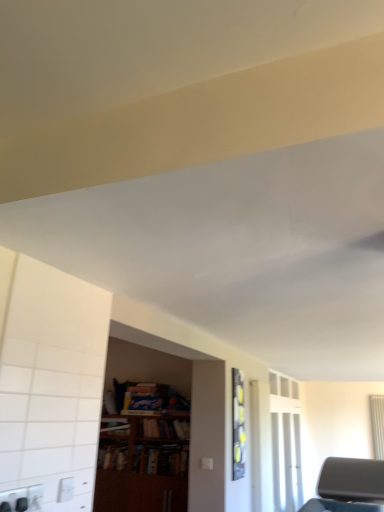
Question: Does transparent glass door at right appear on the left side of wooden bookcase at center?

Choices:
 (A) no
 (B) yes

Answer: (A)

Question: Is transparent glass door at right wider than wooden bookcase at center?

Choices:
 (A) yes
 (B) no

Answer: (B)

Question: Does transparent glass door at right have a lesser height compared to wooden bookcase at center?

Choices:
 (A) yes
 (B) no

Answer: (B)

Question: From the image's perspective, would you say transparent glass door at right is shown under wooden bookcase at center?

Choices:
 (A) no
 (B) yes

Answer: (B)

Question: Is transparent glass door at right bigger than wooden bookcase at center?

Choices:
 (A) no
 (B) yes

Answer: (A)

Question: Is transparent glass door at right to the right of wooden bookcase at center from the viewer's perspective?

Choices:
 (A) no
 (B) yes

Answer: (B)

Question: Is white plastic electric outlet at lower left facing towards wooden bookshelf at center?

Choices:
 (A) no
 (B) yes

Answer: (A)

Question: From the image's perspective, is white plastic electric outlet at lower left under wooden bookshelf at center?

Choices:
 (A) no
 (B) yes

Answer: (A)

Question: From a real-world perspective, is white plastic electric outlet at lower left positioned over wooden bookshelf at center based on gravity?

Choices:
 (A) yes
 (B) no

Answer: (B)

Question: Does white plastic electric outlet at lower left have a smaller size compared to wooden bookshelf at center?

Choices:
 (A) yes
 (B) no

Answer: (A)

Question: From a real-world perspective, is white plastic electric outlet at lower left beneath wooden bookshelf at center?

Choices:
 (A) no
 (B) yes

Answer: (B)

Question: From the image's perspective, is white plastic electric outlet at lower left on top of wooden bookshelf at center?

Choices:
 (A) no
 (B) yes

Answer: (B)

Question: From the image's perspective, would you say wooden bookcase at center is positioned over transparent glass door at right?

Choices:
 (A) yes
 (B) no

Answer: (A)